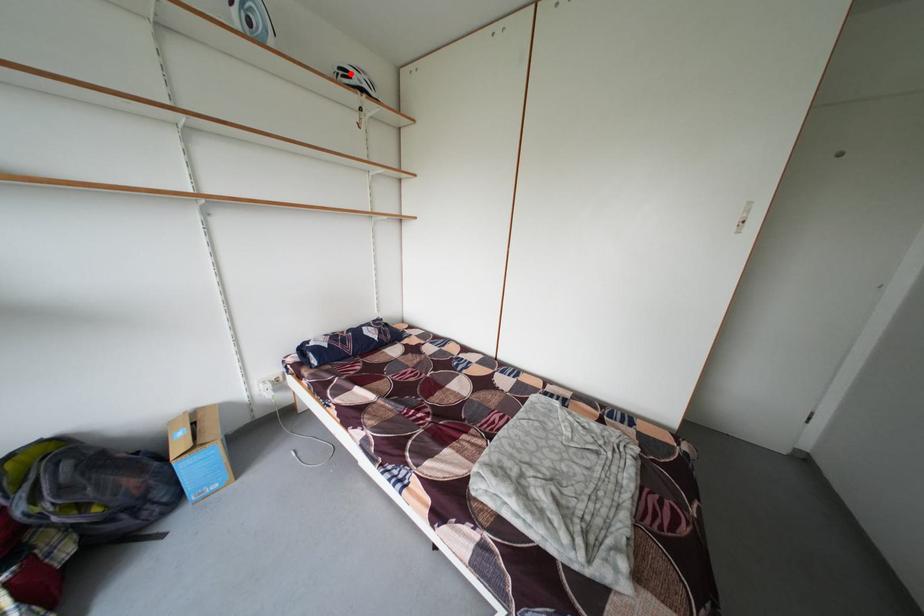
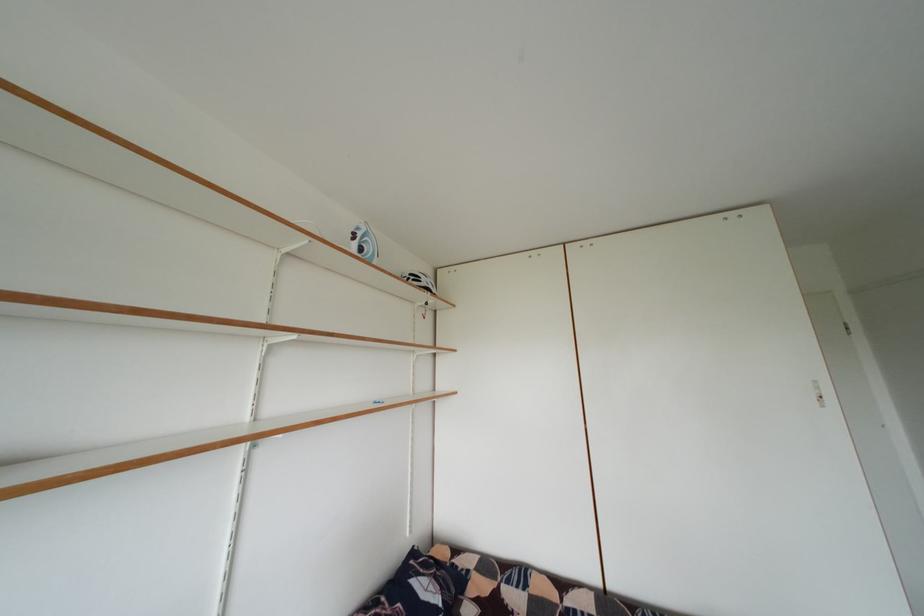
In the second image, find the point that corresponds to the highlighted location in the first image.

(420, 281)